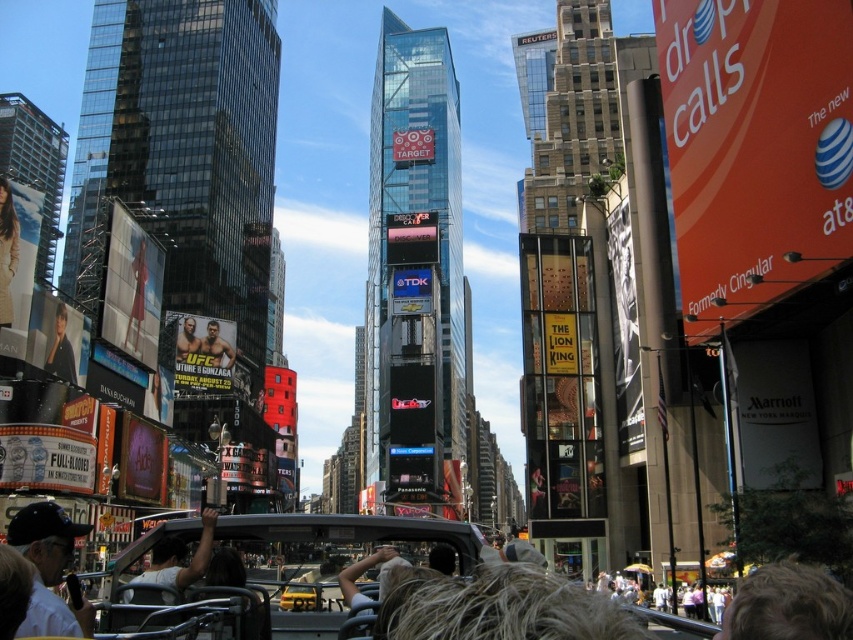
You are a photographer trying to capture a photo of the yellow matte taxi at center without including any people in the frame. Given the current scene, is it possible to position yourself so that the blonde hair at lower right does not block the view of the taxi?

The blonde hair at lower right is wider than the yellow matte taxi at center. Since the blonde hair is positioned at the lower right and the taxi is at the center, adjusting your position might allow you to frame the shot so the taxi is visible without the hair blocking it, provided there is enough space between them. However, the width comparison suggests the hair might still interfere depending on the angle.

You are a photographer trying to capture a candid shot of the crowd in the bustling urban scene. You notice a person with blonde hair at lower right. Where exactly is this person located in the frame?

The blonde hair at lower right is located at point coordinates of 0.947 on the x axis and 0.925 on the y axis.